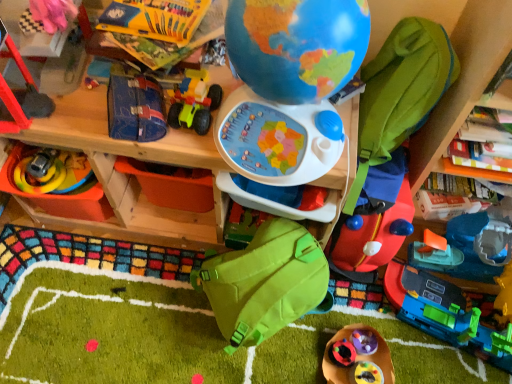
Question: Would you say green fabric backpack at lower center, which ranks as the sixth toy in right-to-left order, is inside or outside rubberized red ladder at left, which is the 2th toy in left-to-right order?

Choices:
 (A) outside
 (B) inside

Answer: (A)

Question: Is point (288, 241) positioned closer to the camera than point (44, 99)?

Choices:
 (A) closer
 (B) farther

Answer: (B)

Question: Which is nearer to the matte plastic toy at lower center, marked as the eighth toy in a left-to-right arrangement?

Choices:
 (A) rubberized red backpack at center-right, which is the first toy in right-to-left order
 (B) blue fabric case at center, positioned as the 9th toy in right-to-left order
 (C) shiny purple toy at lower center, the second toy from the right
 (D) wooden table at center
 (E) rubberized plastic toy at lower center, the 3th toy viewed from the right

Answer: (E)

Question: Which is nearer to the rubberized black toy at lower center, which appears as the 5th toy when viewed from the right?

Choices:
 (A) green fabric backpack at lower center, which ranks as the sixth toy in right-to-left order
 (B) metallic silver car at lower left, arranged as the eleventh toy when viewed from the right
 (C) rubberized red backpack at center-right, which is the first toy in right-to-left order
 (D) rubberized plastic toy at lower center, the 3th toy viewed from the right
 (E) shiny purple toy at lower center, which is counted as the 10th toy, starting from the left

Answer: (D)